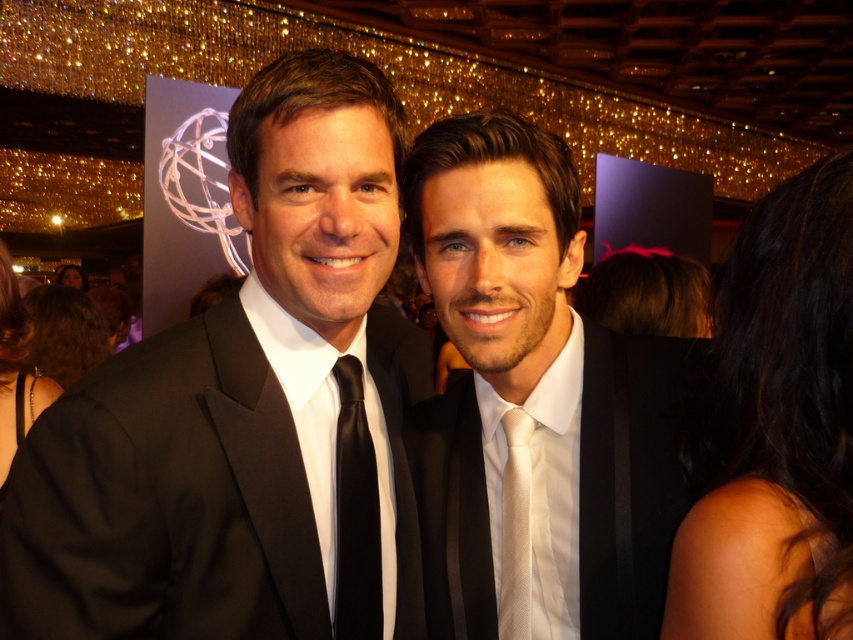
Question: Which point is closer to the camera?

Choices:
 (A) black satin dress at lower left
 (B) curly brown hair at left

Answer: (A)

Question: Which of the following is the farthest from the observer?

Choices:
 (A) (525, 456)
 (B) (82, 371)
 (C) (251, 608)

Answer: (B)

Question: Which point is closer to the camera taking this photo?

Choices:
 (A) (779, 195)
 (B) (524, 496)
 (C) (80, 333)

Answer: (A)

Question: Is black satin suit at center smaller than dark brown hair at upper left?

Choices:
 (A) yes
 (B) no

Answer: (A)

Question: Observing the image, what is the correct spatial positioning of dark brown hair at upper right in reference to curly brown hair at left?

Choices:
 (A) right
 (B) left

Answer: (A)

Question: Is curly brown hair at left to the right of dark brown hair at upper left from the viewer's perspective?

Choices:
 (A) no
 (B) yes

Answer: (B)